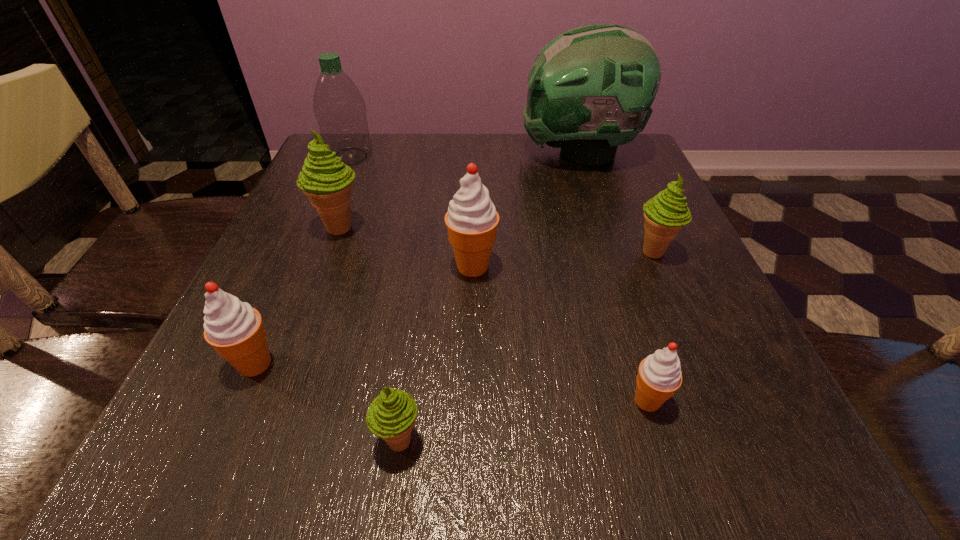
You are a GUI agent. You are given a task and a screenshot of the screen. Output one action in this format:
    pyautogui.click(x=<x>, y=<y>)
    Task: Click on the smallest red icecream
    
    Given the screenshot: What is the action you would take?
    pyautogui.click(x=659, y=376)

Locate an element on the screen. the second green icecream from right to left is located at coordinates (391, 415).

Locate an element on the screen. the nearest green icecream is located at coordinates (391, 415).

Locate an element on the screen. This screenshot has height=540, width=960. vacant space located on the visor of the green football helmet is located at coordinates (388, 153).

Identify the location of vacant space located 0.250m on the visor of the green football helmet. The width and height of the screenshot is (960, 540). (420, 153).

Identify the location of vacant point located 0.100m on the visor of the green football helmet. (480, 153).

This screenshot has height=540, width=960. I want to click on blank area located 0.360m on the front of the green water bottle, so click(301, 273).

Locate an element on the screen. This screenshot has width=960, height=540. vacant region located 0.140m on the right of the leftmost green icecream is located at coordinates tap(435, 227).

Find the location of a particular element. The width and height of the screenshot is (960, 540). vacant space located on the right of the third icecream from right to left is located at coordinates (608, 266).

Where is `blank space located on the left of the rightmost icecream`? blank space located on the left of the rightmost icecream is located at coordinates (606, 251).